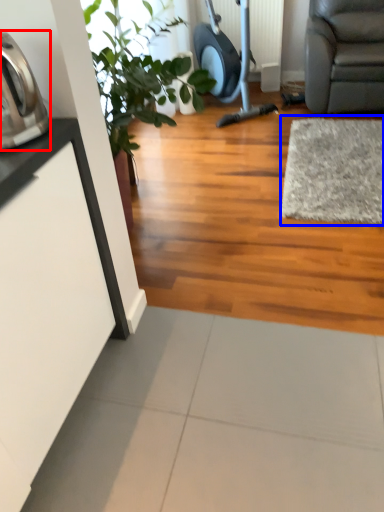
Question: Which of the following is the farthest to the observer, appliance (highlighted by a red box) or mat (highlighted by a blue box)?

Choices:
 (A) appliance
 (B) mat

Answer: (B)